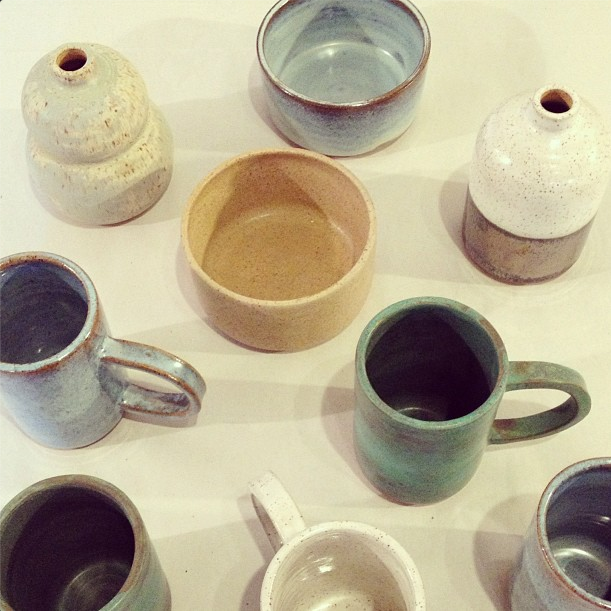
Where is `coffee cup`? coffee cup is located at coordinates (142, 585), (313, 590), (585, 539), (420, 352), (37, 365).